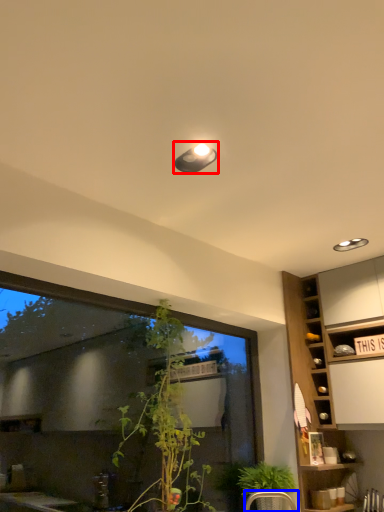
Question: Which of the following is the farthest to the observer, light fixture (highlighted by a red box) or armchair (highlighted by a blue box)?

Choices:
 (A) light fixture
 (B) armchair

Answer: (B)